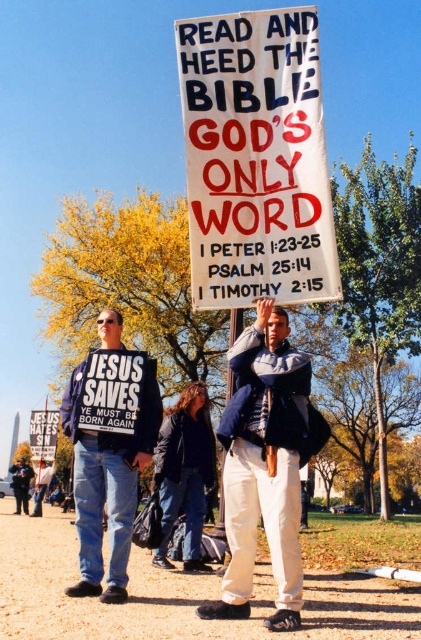
You are a photographer trying to capture the white paper sign at center and the black cotton shirt at center in a single shot. Based on their positions, can you see both objects clearly in the photo?

The white paper sign at center is positioned over the black cotton shirt at center, so the sign will partially or fully block the shirt in the photo, making it difficult to see the black cotton shirt at center clearly.

What are the coordinates of the white paper sign at center?

The white paper sign at center is located at coordinates point (255, 160).

You are a photographer standing at the origin point of the coordinate system. You want to capture the white paper sign at center in your shot. What are the coordinates where you should aim your camera?

The white paper sign at center is located at coordinates point [255,160], so you should aim your camera at those coordinates to capture it.